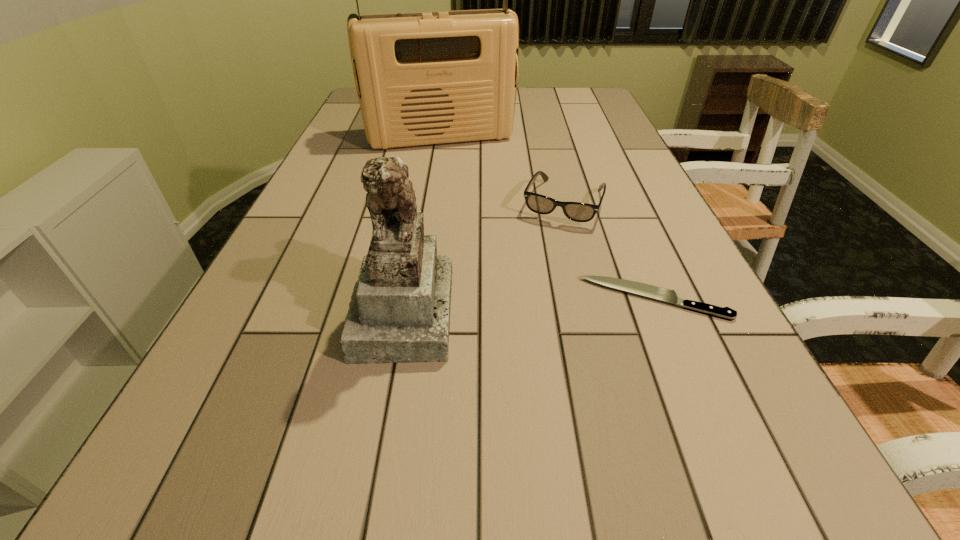
Locate which object ranks second in proximity to the tallest object. Please provide its 2D coordinates. Your answer should be formatted as a tuple, i.e. [(x, y)], where the tuple contains the x and y coordinates of a point satisfying the conditions above.

[(400, 312)]